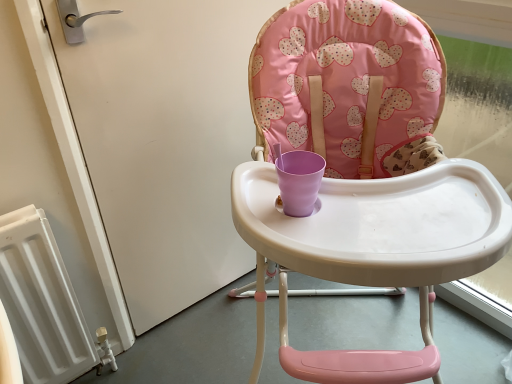
Question: Considering their positions, is white glossy screen door at left located in front of or behind pink fabric highchair at center?

Choices:
 (A) behind
 (B) front

Answer: (A)

Question: Considering the positions of white glossy screen door at left and pink fabric highchair at center in the image, is white glossy screen door at left bigger or smaller than pink fabric highchair at center?

Choices:
 (A) big
 (B) small

Answer: (B)

Question: In the image, is white glossy screen door at left on the left side or the right side of pink fabric highchair at center?

Choices:
 (A) right
 (B) left

Answer: (B)

Question: Considering the positions of pink fabric highchair at center and white glossy screen door at left in the image, is pink fabric highchair at center wider or thinner than white glossy screen door at left?

Choices:
 (A) wide
 (B) thin

Answer: (A)

Question: Looking at the image, does pink fabric highchair at center seem bigger or smaller compared to white glossy screen door at left?

Choices:
 (A) big
 (B) small

Answer: (A)

Question: In the image, is pink fabric highchair at center positioned in front of or behind white glossy screen door at left?

Choices:
 (A) front
 (B) behind

Answer: (A)

Question: Choose the correct answer: Is pink fabric highchair at center inside white glossy screen door at left or outside it?

Choices:
 (A) outside
 (B) inside

Answer: (A)